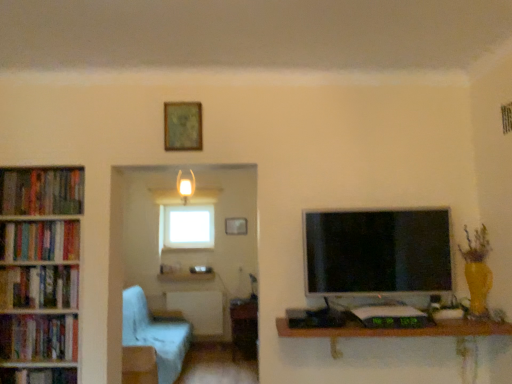
The height and width of the screenshot is (384, 512). In order to click on wooden shelf at lower right, the first table from the top in this screenshot , I will do `click(394, 331)`.

Describe the element at coordinates (185, 186) in the screenshot. I see `matte glass lampshade at upper center` at that location.

Find the location of a particular element. The width and height of the screenshot is (512, 384). hardcover books at left, the 3th book viewed from the top is located at coordinates (39, 287).

What is the approximate width of hardcover books at left, the third book in the bottom-to-top sequence?

6.48 inches.

You are a GUI agent. You are given a task and a screenshot of the screen. Output one action in this format:
    pyautogui.click(x=<x>, y=<y>)
    Task: Click on the hardcover book at left, acting as the first book starting from the bottom
    This screenshot has width=512, height=384.
    Given the screenshot: What is the action you would take?
    pyautogui.click(x=38, y=376)

Locate an element on the screen. The image size is (512, 384). wooden shelf at lower right, which is counted as the second table, starting from the bottom is located at coordinates (394, 331).

Is matte green frame at upper center, which is the 1th picture frame from front to back, in front of or behind transparent glass window at center in the image?

matte green frame at upper center, which is the 1th picture frame from front to back, is positioned closer to the viewer than transparent glass window at center.

Locate an element on the screen. The height and width of the screenshot is (384, 512). window on the left of the matte green frame at upper center, the second picture frame from the bottom is located at coordinates (186, 227).

From a real-world perspective, is matte green frame at upper center, the second picture frame from the bottom, on transparent glass window at center?

Correct, in the physical world, matte green frame at upper center, the second picture frame from the bottom, is higher than transparent glass window at center.

Is there a large distance between light blue fabric armchair at left and hardcover books at left, the fifth book ordered from the bottom?

light blue fabric armchair at left is far away from hardcover books at left, the fifth book ordered from the bottom.

Considering the sizes of objects light blue fabric armchair at left and hardcover books at left, the fifth book ordered from the bottom, in the image provided, who is wider, light blue fabric armchair at left or hardcover books at left, the fifth book ordered from the bottom,?

light blue fabric armchair at left is wider.

Which object is positioned more to the left, light blue fabric armchair at left or hardcover books at left, which appears as the 1th book when viewed from the top?

hardcover books at left, which appears as the 1th book when viewed from the top, is more to the left.

Considering the relative sizes of matte glass lampshade at upper center and hardcover books at left, acting as the 4th book starting from the top, in the image provided, is matte glass lampshade at upper center wider than hardcover books at left, acting as the 4th book starting from the top,?

Yes, matte glass lampshade at upper center is wider than hardcover books at left, acting as the 4th book starting from the top.

How many degrees apart are the facing directions of matte glass lampshade at upper center and hardcover books at left, placed as the 2th book when sorted from bottom to top?

0.251 degrees.

Is matte glass lampshade at upper center completely or partially outside of hardcover books at left, placed as the 2th book when sorted from bottom to top?

That's correct, matte glass lampshade at upper center is outside of hardcover books at left, placed as the 2th book when sorted from bottom to top.

Between matte glass lampshade at upper center and hardcover books at left, placed as the 2th book when sorted from bottom to top, which one has less height?

Standing shorter between the two is hardcover books at left, placed as the 2th book when sorted from bottom to top.

From the image's perspective, which one is positioned higher, hardcover books at left, which appears as the 1th book when viewed from the top, or wooden bookshelf at left?

hardcover books at left, which appears as the 1th book when viewed from the top, is shown above in the image.

Identify the location of book that is the 2nd object above the wooden bookshelf at left (from a real-world perspective). (42, 191).

Between hardcover books at left, the fifth book ordered from the bottom, and wooden bookshelf at left, which one appears on the left side from the viewer's perspective?

hardcover books at left, the fifth book ordered from the bottom.

Considering the relative sizes of hardcover books at left, which appears as the 1th book when viewed from the top, and wooden bookshelf at left in the image provided, is hardcover books at left, which appears as the 1th book when viewed from the top, taller than wooden bookshelf at left?

In fact, hardcover books at left, which appears as the 1th book when viewed from the top, may be shorter than wooden bookshelf at left.

Can you confirm if hardcover books at left, which appears as the 1th book when viewed from the top, is smaller than wooden table at center, which ranks as the first table in bottom-to-top order?

Yes, hardcover books at left, which appears as the 1th book when viewed from the top, is smaller than wooden table at center, which ranks as the first table in bottom-to-top order.

Which is behind, point (14, 195) or point (234, 317)?

The point (234, 317) is farther from the camera.

From a real-world perspective, who is located higher, hardcover books at left, which appears as the 1th book when viewed from the top, or wooden table at center, which is the 2th table in top-to-bottom order?

In real-world perspective, hardcover books at left, which appears as the 1th book when viewed from the top, is above.

Is hardcover books at left, the fifth book ordered from the bottom, facing towards matte white desk at center?

No, hardcover books at left, the fifth book ordered from the bottom, does not turn towards matte white desk at center.

Considering the sizes of hardcover books at left, the fifth book ordered from the bottom, and matte white desk at center in the image, is hardcover books at left, the fifth book ordered from the bottom, bigger or smaller than matte white desk at center?

hardcover books at left, the fifth book ordered from the bottom, is smaller than matte white desk at center.

In terms of height, does hardcover books at left, the fifth book ordered from the bottom, look taller or shorter compared to matte white desk at center?

Considering their sizes, hardcover books at left, the fifth book ordered from the bottom, has less height than matte white desk at center.

Which point is more forward, (200, 313) or (239, 232)?

Positioned in front is point (200, 313).

Measure the distance from matte white desk at center to wooden picture frame at center, the first picture frame when ordered from bottom to top.

matte white desk at center is 3.95 feet from wooden picture frame at center, the first picture frame when ordered from bottom to top.

Is matte white desk at center to the left or to the right of wooden picture frame at center, which appears as the 2th picture frame when viewed from the front, in the image?

matte white desk at center is to the left of wooden picture frame at center, which appears as the 2th picture frame when viewed from the front.

Locate an element on the screen. The width and height of the screenshot is (512, 384). computer desk below the wooden picture frame at center, which appears as the first picture frame when viewed from the back (from the image's perspective) is located at coordinates (199, 309).

Image resolution: width=512 pixels, height=384 pixels. Find the location of `window on the left of matte green frame at upper center, which is counted as the first picture frame, starting from the top`. window on the left of matte green frame at upper center, which is counted as the first picture frame, starting from the top is located at coordinates (186, 227).

What are the coordinates of `book that is the 1st object located in front of the light blue fabric armchair at left` in the screenshot? It's located at coord(42,191).

Which object lies nearer to the anchor point hardcover book at left, which is the fifth book in top-to-bottom order, hardcover books at left, the third book in the bottom-to-top sequence, or hardcover books at left, arranged as the 2th book when viewed from the top?

hardcover books at left, the third book in the bottom-to-top sequence, is closer to hardcover book at left, which is the fifth book in top-to-bottom order.

Based on their spatial positions, is hardcover books at left, which appears as the 1th book when viewed from the top, or light blue fabric armchair at left further from transparent glass window at center?

Based on the image, hardcover books at left, which appears as the 1th book when viewed from the top, appears to be further to transparent glass window at center.

From the picture: Which object lies further to the anchor point transparent glass window at center, hardcover books at left, placed as the 2th book when sorted from bottom to top, or hardcover books at left, which appears as the 1th book when viewed from the top?

Among the two, hardcover books at left, which appears as the 1th book when viewed from the top, is located further to transparent glass window at center.

Which object lies nearer to the anchor point wooden table at center, which ranks as the first table in bottom-to-top order, wooden bookshelf at left or hardcover book at left, acting as the first book starting from the bottom?

hardcover book at left, acting as the first book starting from the bottom, is closer to wooden table at center, which ranks as the first table in bottom-to-top order.

In the scene shown: From the image, which object appears to be nearer to hardcover books at left, the third book in the bottom-to-top sequence, wooden table at center, which ranks as the first table in bottom-to-top order, or matte green frame at upper center, the second picture frame viewed from the back?

matte green frame at upper center, the second picture frame viewed from the back, is positioned closer to the anchor hardcover books at left, the third book in the bottom-to-top sequence.

Based on their spatial positions, is hardcover books at left, placed as the 2th book when sorted from bottom to top, or matte white desk at center closer to wooden table at center, the 1th table viewed from the left?

The object closer to wooden table at center, the 1th table viewed from the left, is matte white desk at center.

When comparing their distances from hardcover book at left, acting as the first book starting from the bottom, does hardcover books at left, the third book in the bottom-to-top sequence, or matte green frame at upper center, which is counted as the first picture frame, starting from the top, seem further?

matte green frame at upper center, which is counted as the first picture frame, starting from the top, is positioned further to the anchor hardcover book at left, acting as the first book starting from the bottom.

When comparing their distances from transparent glass window at center, does hardcover books at left, acting as the 4th book starting from the top, or matte black monitor at right seem closer?

The object closer to transparent glass window at center is hardcover books at left, acting as the 4th book starting from the top.

Where is `armchair located between hardcover books at left, the 3th book viewed from the top, and matte white desk at center in the depth direction`? This screenshot has height=384, width=512. armchair located between hardcover books at left, the 3th book viewed from the top, and matte white desk at center in the depth direction is located at coordinates (155, 334).

The height and width of the screenshot is (384, 512). I want to click on table located between hardcover books at left, acting as the 4th book starting from the top, and transparent glass window at center in the depth direction, so click(244, 327).

Identify the location of computer desk between hardcover books at left, which appears as the 1th book when viewed from the top, and transparent glass window at center in the front-back direction. This screenshot has height=384, width=512. (199, 309).

Image resolution: width=512 pixels, height=384 pixels. I want to click on table between hardcover book at left, acting as the first book starting from the bottom, and transparent glass window at center from front to back, so click(x=244, y=327).